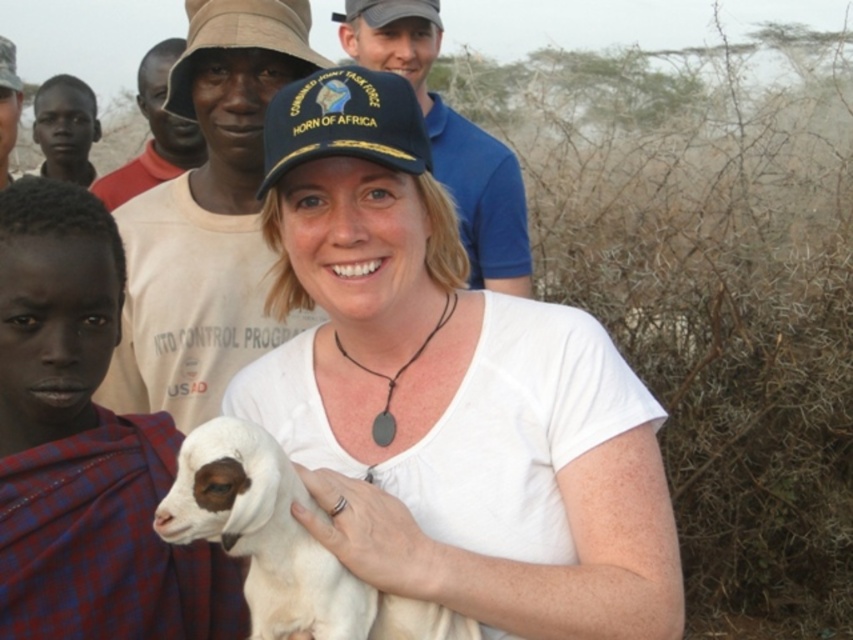
Question: Based on their relative distances, which object is nearer to the white matte shirt at center?

Choices:
 (A) white woolen lamb at center
 (B) white cotton shirt at center
 (C) tan cotton shirt at upper center

Answer: (A)

Question: Which point appears farthest from the camera in this image?

Choices:
 (A) (364, 400)
 (B) (392, 49)
 (C) (259, 3)

Answer: (B)

Question: Does white woolen lamb at center have a larger size compared to blue fabric cap at upper center?

Choices:
 (A) yes
 (B) no

Answer: (B)

Question: Does plaid fabric cloth at left appear under white cotton shirt at center?

Choices:
 (A) yes
 (B) no

Answer: (A)

Question: Observing the image, what is the correct spatial positioning of blue fabric cap at upper center in reference to tan cotton shirt at upper center?

Choices:
 (A) left
 (B) right

Answer: (B)

Question: Which object is positioned closest to the tan cotton shirt at upper center?

Choices:
 (A) white cotton shirt at center
 (B) white woolen lamb at center
 (C) plaid fabric cloth at left
 (D) white matte shirt at center

Answer: (A)